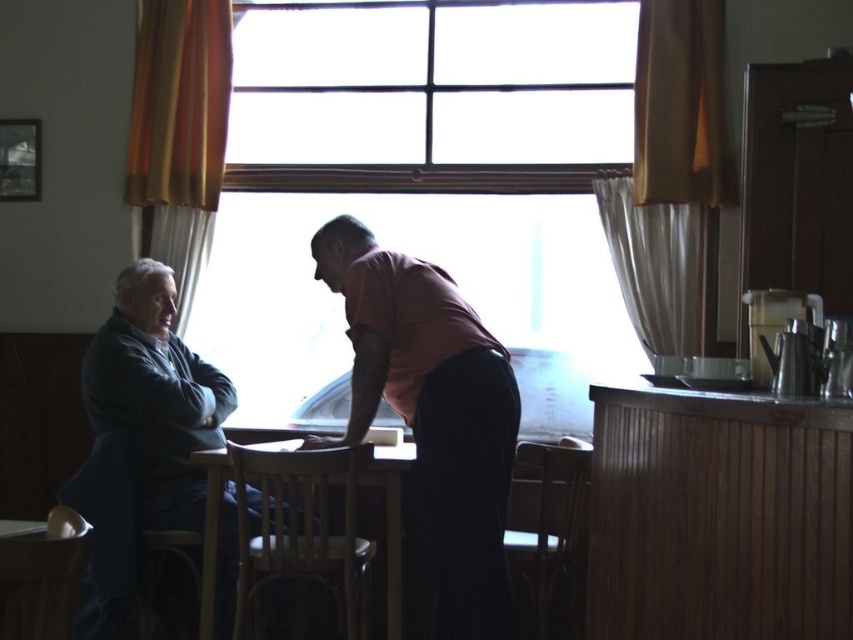
Question: Is matte pink shirt at center above dark blue sweater at left?

Choices:
 (A) no
 (B) yes

Answer: (B)

Question: Can you confirm if dark gray sweater at left is thinner than matte pink shirt at center?

Choices:
 (A) no
 (B) yes

Answer: (A)

Question: Among these objects, which one is nearest to the camera?

Choices:
 (A) dark blue sweater at left
 (B) dark gray sweater at left
 (C) matte pink shirt at center
 (D) wooden table at center

Answer: (C)

Question: Is the position of matte pink shirt at center less distant than that of wooden table at center?

Choices:
 (A) no
 (B) yes

Answer: (B)

Question: Which of the following is the farthest from the observer?

Choices:
 (A) dark gray sweater at left
 (B) wooden table at center
 (C) matte pink shirt at center

Answer: (B)

Question: Which of these objects is positioned closest to the dark blue sweater at left?

Choices:
 (A) matte pink shirt at center
 (B) dark gray sweater at left
 (C) wooden table at center

Answer: (B)